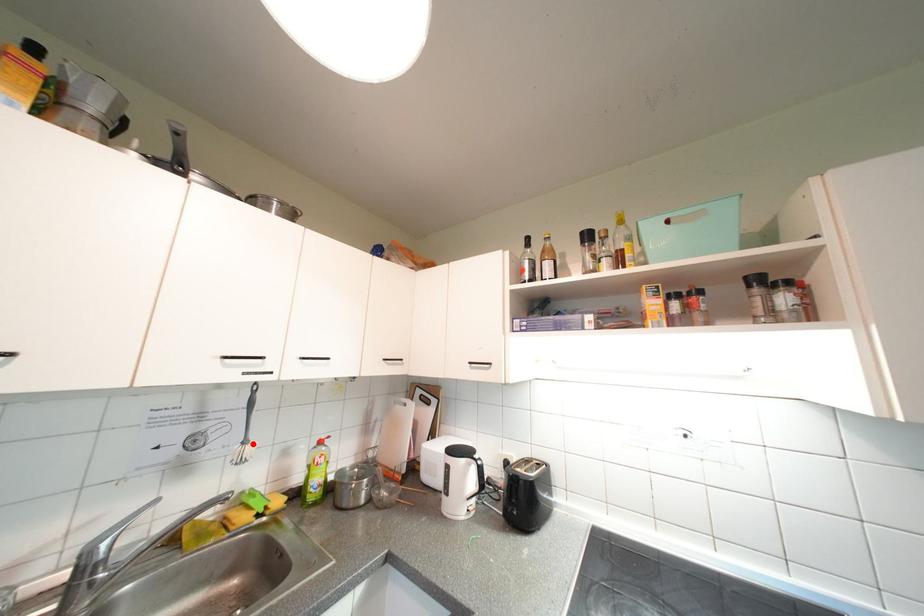
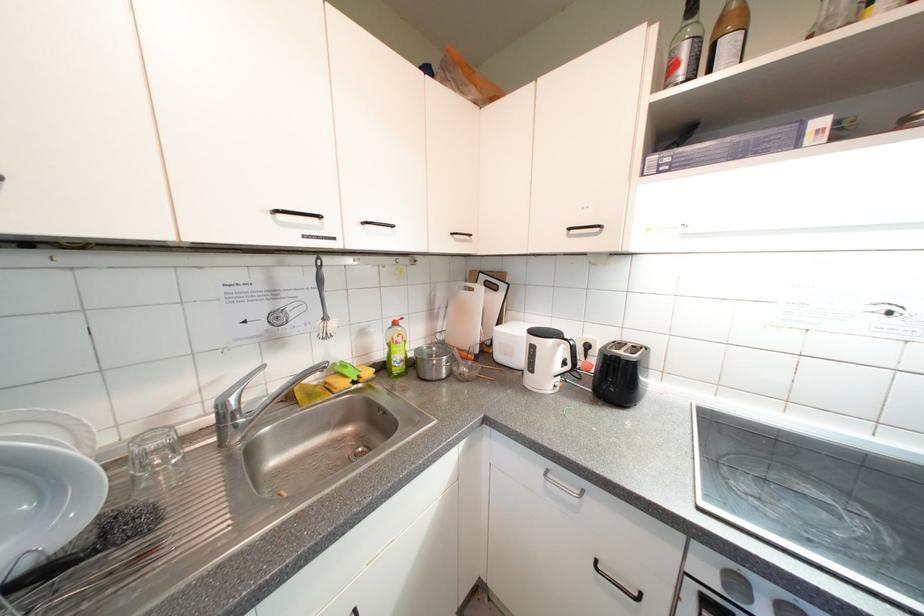
Find the pixel in the second image that matches the highlighted location in the first image.

(333, 321)